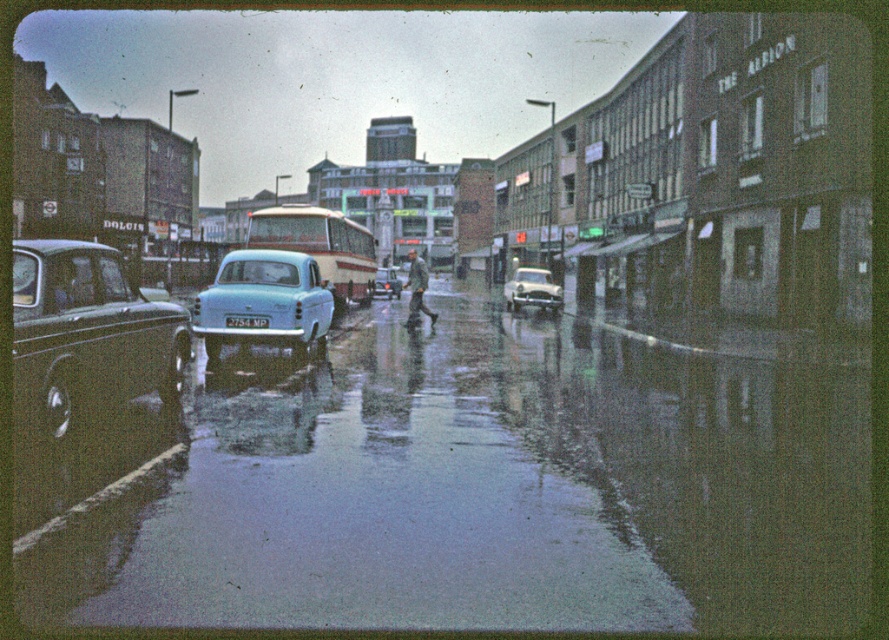
Is shiny black sedan at left to the left of beige fabric bus at center from the viewer's perspective?

Incorrect, shiny black sedan at left is not on the left side of beige fabric bus at center.

Between shiny black sedan at left and beige fabric bus at center, which one appears on the right side from the viewer's perspective?

Positioned to the right is shiny black sedan at left.

Image resolution: width=889 pixels, height=640 pixels. Describe the element at coordinates (87, 333) in the screenshot. I see `shiny black sedan at left` at that location.

Where is `shiny black sedan at left`? The width and height of the screenshot is (889, 640). shiny black sedan at left is located at coordinates (87, 333).

Which of these two, glossy asphalt water at center or white plastic license plate at center, stands shorter?

white plastic license plate at center

Find the location of a particular element. This screenshot has height=640, width=889. glossy asphalt water at center is located at coordinates (470, 488).

Which is in front, point (785, 541) or point (239, 317)?

Point (785, 541) is in front.

Image resolution: width=889 pixels, height=640 pixels. Find the location of `glossy asphalt water at center`. glossy asphalt water at center is located at coordinates (470, 488).

Can you confirm if beige fabric bus at center is wider than light blue glossy car at center?

Yes.

Can you confirm if beige fabric bus at center is shorter than light blue glossy car at center?

No.

Who is more forward, (338, 257) or (393, 285)?

Point (338, 257) is in front.

Identify the location of beige fabric bus at center. (321, 246).